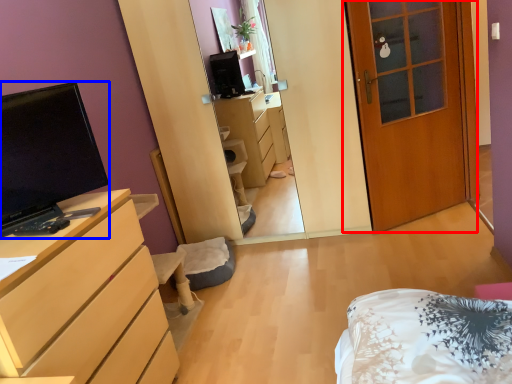
Question: Which object is further to the camera taking this photo, door (highlighted by a red box) or television (highlighted by a blue box)?

Choices:
 (A) door
 (B) television

Answer: (A)